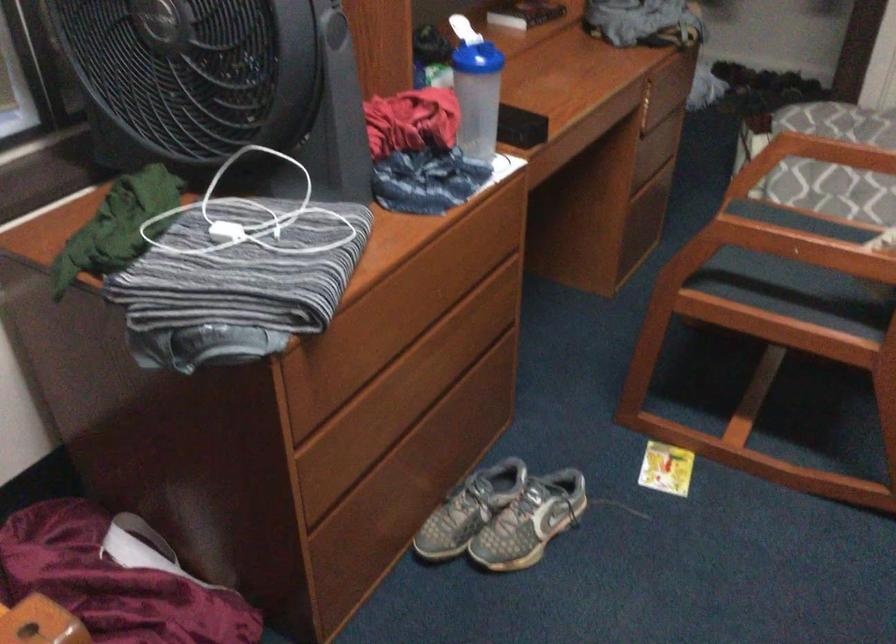
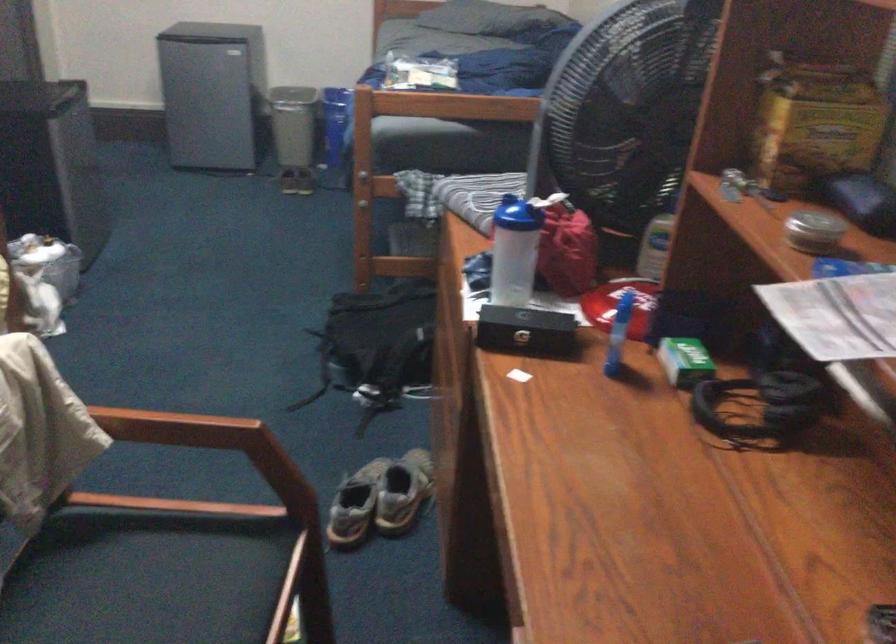
Locate, in the second image, the point that corresponds to pixel 435 69 in the first image.

(685, 361)